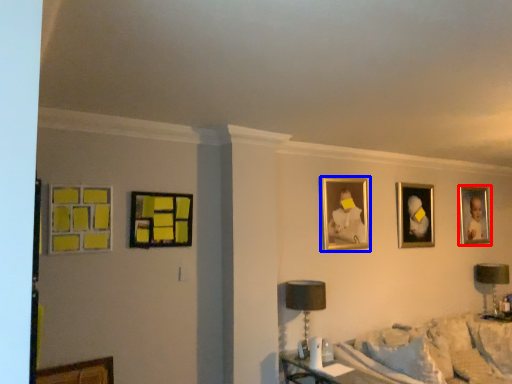
Question: Which object appears closest to the camera in this image, picture frame (highlighted by a red box) or picture frame (highlighted by a blue box)?

Choices:
 (A) picture frame
 (B) picture frame

Answer: (B)